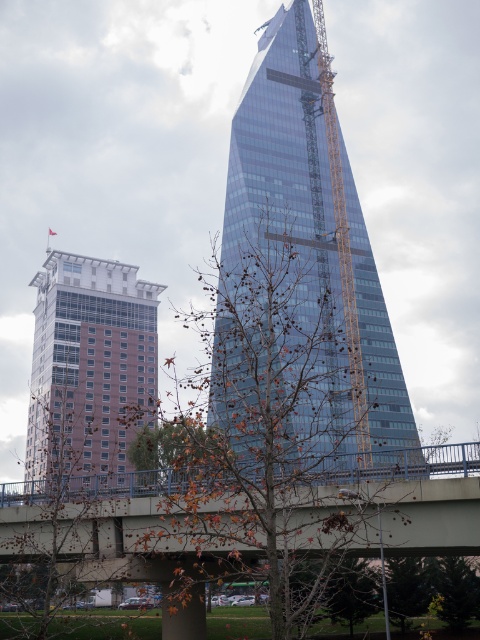
Question: Considering the real-world distances, which object is farthest from the concrete bridge at lower center?

Choices:
 (A) yellow metallic crane at center
 (B) brown leafy tree at center

Answer: (B)

Question: Which point is closer to the camera?

Choices:
 (A) (112, 547)
 (B) (335, 177)

Answer: (A)

Question: Can you confirm if glassy blue skyscraper at center is positioned to the right of brown leafy tree at center?

Choices:
 (A) yes
 (B) no

Answer: (A)

Question: Can you confirm if concrete bridge at lower center is positioned to the left of brown brick building at left?

Choices:
 (A) yes
 (B) no

Answer: (B)

Question: Where is brown brick building at left located in relation to yellow metallic crane at center in the image?

Choices:
 (A) above
 (B) below

Answer: (B)

Question: Which point is closer to the camera taking this photo?

Choices:
 (A) (56, 428)
 (B) (403, 484)
 (C) (349, 266)
 (D) (302, 19)

Answer: (B)